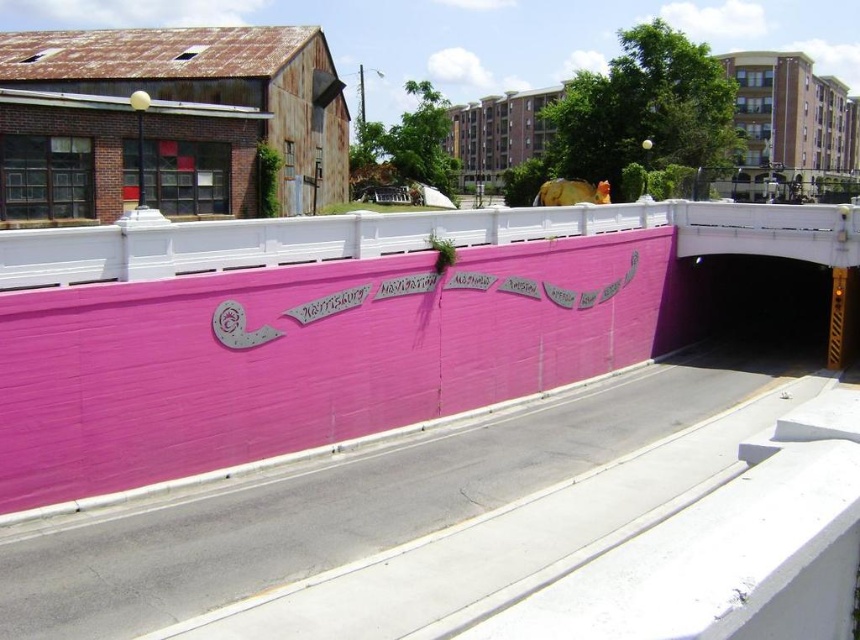
You are a delivery driver who needs to park your truck near the pink painted wall at center and the pink concrete highway at center. Your truck requires a parking space of at least 15 feet. Can you park between them?

The pink painted wall at center is 12.45 feet from the pink concrete highway at center, which is less than the required 15 feet for your truck. Therefore, you cannot park between them.

You are a city planner assessing the space between the pink painted wall at center and the pink concrete highway at center. Which one is wider?

The pink painted wall at center is wider than the pink concrete highway at center.

You are a painter standing on the sidewalk next to the pink painted wall at center and the pink concrete highway at center. You want to paint a mural on the surface that is taller. Which surface should you choose?

The pink painted wall at center is taller than the pink concrete highway at center, so you should choose the pink painted wall at center to paint your mural.